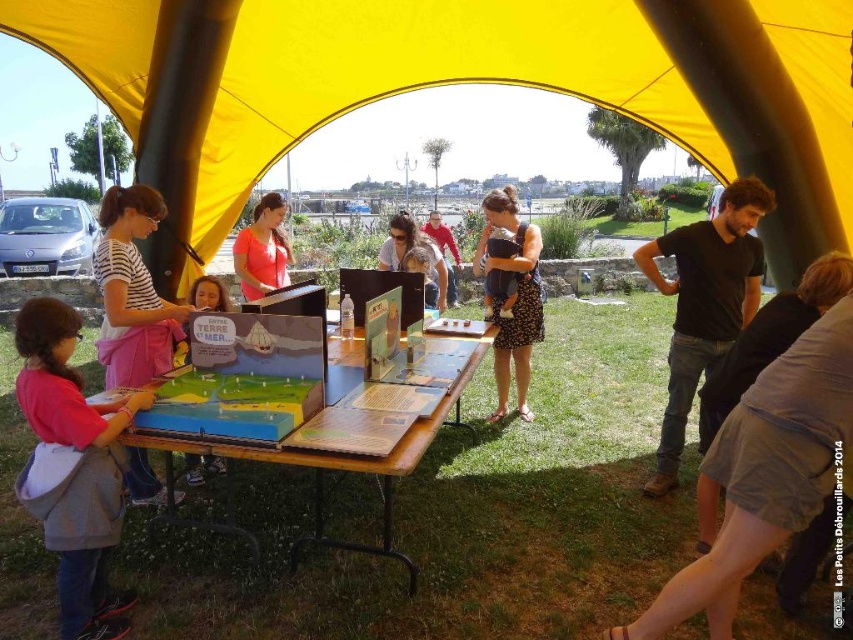
Can you confirm if yellow fabric canopy at upper center is wider than matte red shirt at center?

In fact, yellow fabric canopy at upper center might be narrower than matte red shirt at center.

Is yellow fabric canopy at upper center above matte red shirt at center?

Yes, yellow fabric canopy at upper center is above matte red shirt at center.

Which is in front, point (120, 22) or point (439, 248)?

Point (120, 22)

Find the location of a particular element. The width and height of the screenshot is (853, 640). yellow fabric canopy at upper center is located at coordinates (540, 88).

Between black cotton shirt at right and matte cardboard poster at center, which one has less height?

With less height is matte cardboard poster at center.

Where is `black cotton shirt at right`? This screenshot has width=853, height=640. black cotton shirt at right is located at coordinates (704, 301).

Can you confirm if black cotton shirt at right is smaller than dotted fabric dress at center?

No.

At what (x,y) coordinates should I click in order to perform the action: click on black cotton shirt at right. Please return your answer as a coordinate pair (x, y). Looking at the image, I should click on (704, 301).